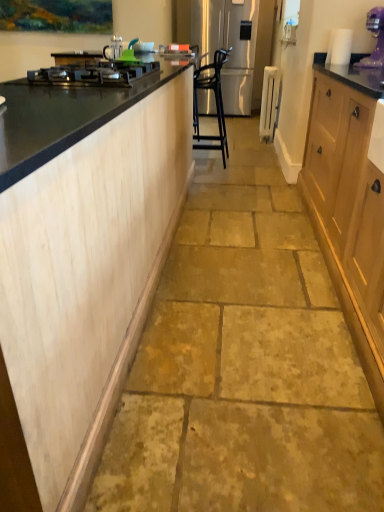
Question: Considering the relative positions of satin silver refrigerator at center and black glass cooktop at left in the image provided, is satin silver refrigerator at center to the left or to the right of black glass cooktop at left?

Choices:
 (A) right
 (B) left

Answer: (A)

Question: From a real-world perspective, is satin silver refrigerator at center physically located above or below black glass cooktop at left?

Choices:
 (A) below
 (B) above

Answer: (A)

Question: Estimate the real-world distances between objects in this image. Which object is closer to the light wood cabinetry at left?

Choices:
 (A) purple plastic blender at upper right
 (B) black glass cooktop at left
 (C) satin silver refrigerator at center
 (D) black metal chair at center

Answer: (B)

Question: Which of these objects is positioned closest to the black metal chair at center?

Choices:
 (A) satin silver refrigerator at center
 (B) purple plastic blender at upper right
 (C) black glass cooktop at left
 (D) light wood cabinetry at left

Answer: (A)